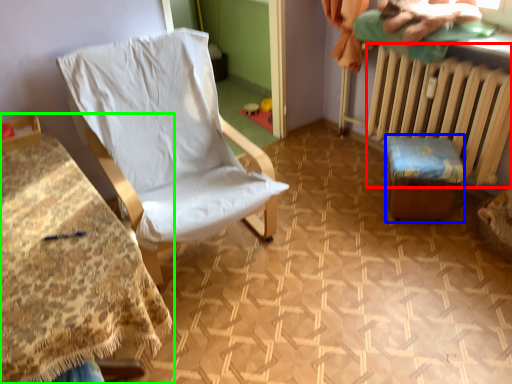
Question: Estimate the real-world distances between objects in this image. Which object is farther from radiator (highlighted by a red box), furniture (highlighted by a blue box) or furniture (highlighted by a green box)?

Choices:
 (A) furniture
 (B) furniture

Answer: (B)